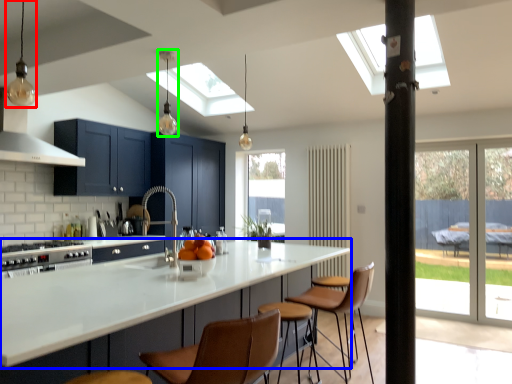
Question: Which is farther away from light fixture (highlighted by a red box)? countertop (highlighted by a blue box) or light fixture (highlighted by a green box)?

Choices:
 (A) countertop
 (B) light fixture

Answer: (B)